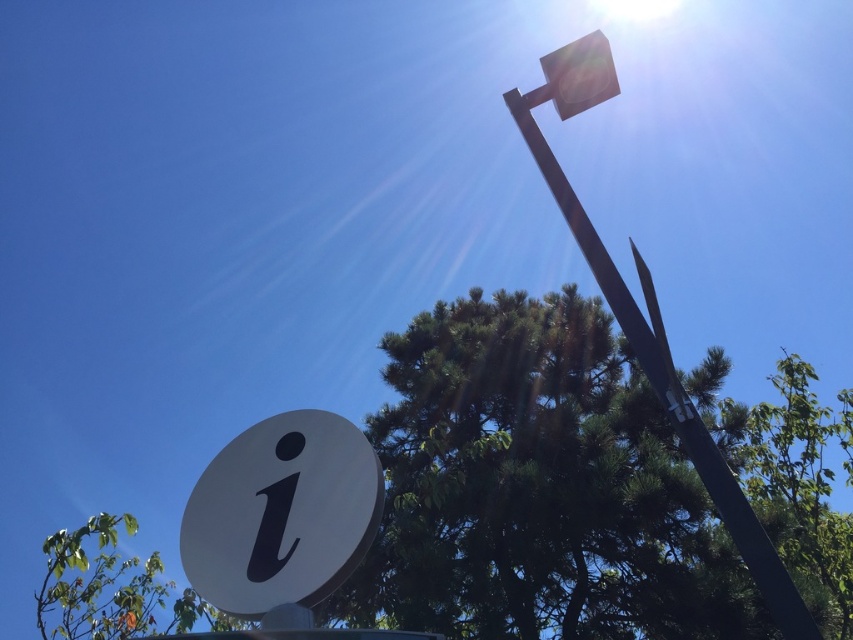
Question: Which point is closer to the camera taking this photo?

Choices:
 (A) (376, 612)
 (B) (688, 428)
 (C) (198, 561)

Answer: (B)

Question: Which point is closer to the camera taking this photo?

Choices:
 (A) (788, 580)
 (B) (498, 356)
 (C) (282, 481)

Answer: (A)

Question: Can you confirm if green leafy tree at center is positioned below metallic gray pole at upper right?

Choices:
 (A) no
 (B) yes

Answer: (B)

Question: Is green leafy tree at center smaller than metallic gray pole at upper right?

Choices:
 (A) yes
 (B) no

Answer: (B)

Question: Which point is farther to the camera?

Choices:
 (A) white matte sign at center
 (B) metallic gray pole at upper right
 (C) green leafy tree at center

Answer: (C)

Question: Can you confirm if green leafy tree at center is smaller than metallic gray pole at upper right?

Choices:
 (A) no
 (B) yes

Answer: (A)